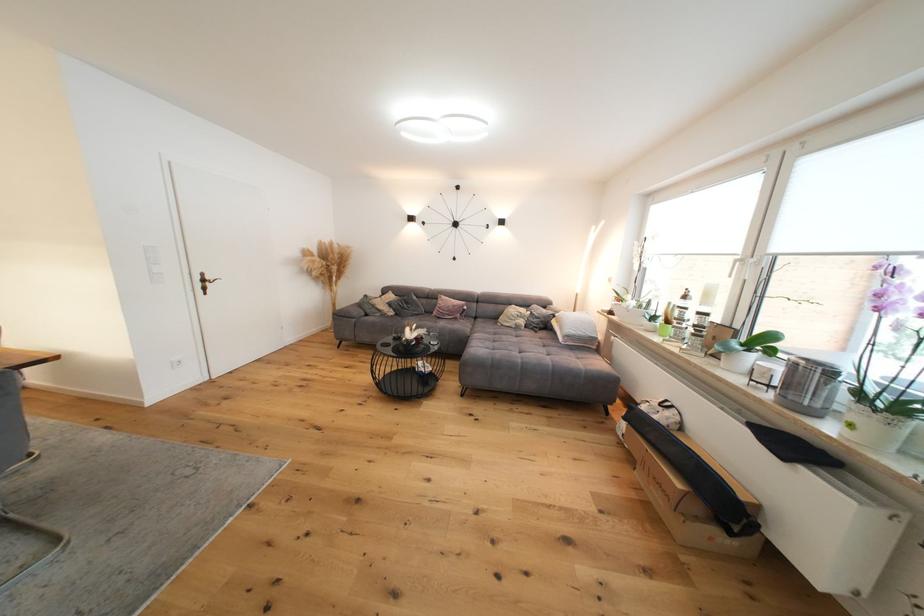
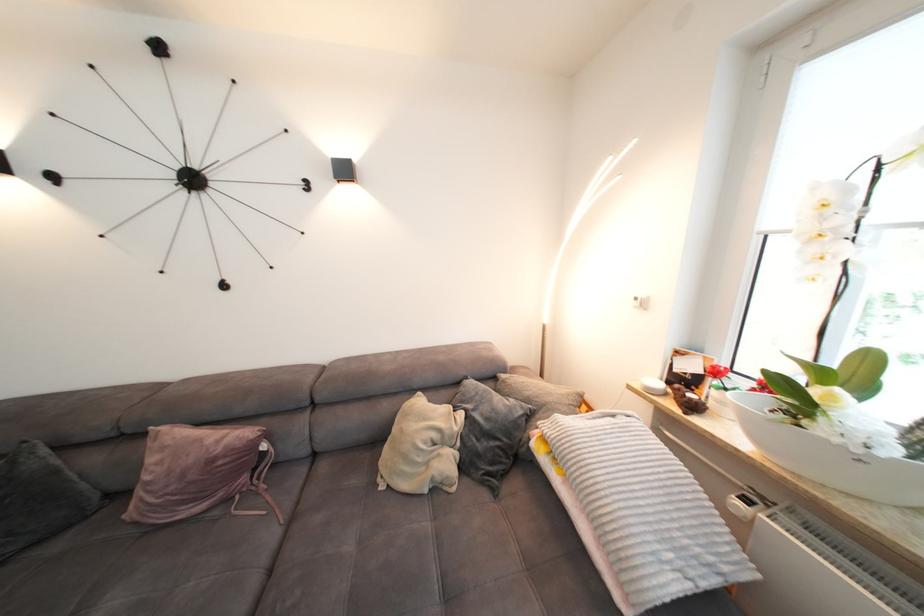
Question: The images are taken continuously from a first-person perspective. In which direction are you moving?

Choices:
 (A) Left
 (B) Right
 (C) Forward
 (D) Backward

Answer: (C)